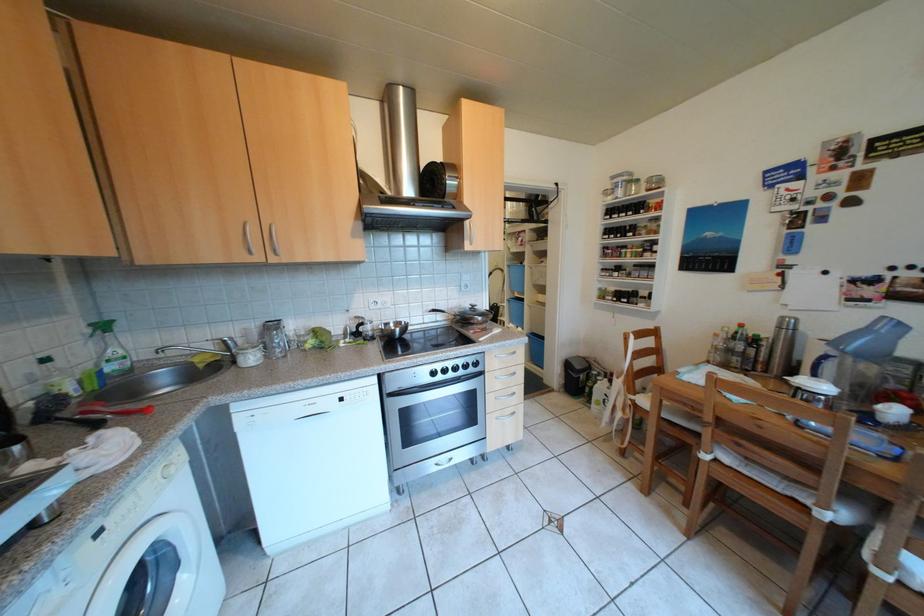
Where is `pan lid handle`? Image resolution: width=924 pixels, height=616 pixels. pan lid handle is located at coordinates (405, 176).